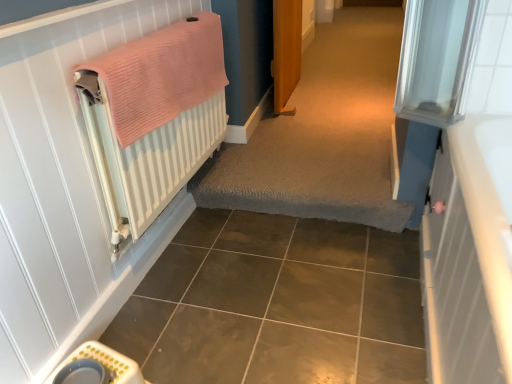
Describe the element at coordinates (162, 75) in the screenshot. The height and width of the screenshot is (384, 512). I see `pink knitted towel at left` at that location.

This screenshot has height=384, width=512. Describe the element at coordinates (146, 158) in the screenshot. I see `white textured radiator at left` at that location.

Describe the element at coordinates (323, 134) in the screenshot. This screenshot has width=512, height=384. I see `textured carpet at center` at that location.

Find the location of a particular element. pink knitted towel at left is located at coordinates (162, 75).

Who is taller, brown glossy ceramic tile at lower center or white textured radiator at left?

Standing taller between the two is white textured radiator at left.

From the image's perspective, who appears lower, brown glossy ceramic tile at lower center or white textured radiator at left?

brown glossy ceramic tile at lower center appears lower in the image.

Does brown glossy ceramic tile at lower center touch white textured radiator at left?

They are not placed beside each other.

Can you tell me how much pink knitted towel at left and white textured radiator at left differ in facing direction?

They differ by 0.00182 degrees in their facing directions.

In terms of size, does pink knitted towel at left appear bigger or smaller than white textured radiator at left?

pink knitted towel at left is smaller than white textured radiator at left.

Who is taller, pink knitted towel at left or white textured radiator at left?

Standing taller between the two is white textured radiator at left.

From the image's perspective, which one is positioned higher, pink knitted towel at left or white textured radiator at left?

pink knitted towel at left, from the image's perspective.

Considering the sizes of objects brown glossy ceramic tile at lower center and pink knitted towel at left in the image provided, who is thinner, brown glossy ceramic tile at lower center or pink knitted towel at left?

pink knitted towel at left.

This screenshot has height=384, width=512. What are the coordinates of `bath towel lying above the brown glossy ceramic tile at lower center (from the image's perspective)` in the screenshot? It's located at click(x=162, y=75).

Is brown glossy ceramic tile at lower center touching pink knitted towel at left?

No, brown glossy ceramic tile at lower center is not in contact with pink knitted towel at left.

Considering the positions of objects brown glossy ceramic tile at lower center and pink knitted towel at left in the image provided, who is in front, brown glossy ceramic tile at lower center or pink knitted towel at left?

Positioned in front is brown glossy ceramic tile at lower center.

Based on the photo, considering the relative positions of pink knitted towel at left and textured carpet at center in the image provided, is pink knitted towel at left to the right of textured carpet at center from the viewer's perspective?

No.

From a real-world perspective, is pink knitted towel at left positioned above or below textured carpet at center?

Clearly, from a real-world perspective, pink knitted towel at left is above textured carpet at center.

Consider the image. Is pink knitted towel at left touching textured carpet at center?

pink knitted towel at left and textured carpet at center are clearly separated.

Locate an element on the screen. bath towel above the textured carpet at center (from a real-world perspective) is located at coordinates (162, 75).

Does brown glossy ceramic tile at lower center come behind textured carpet at center?

That is False.

Is point (262, 231) farther from camera compared to point (345, 214)?

Yes, it is.

Is brown glossy ceramic tile at lower center not close to textured carpet at center?

Actually, brown glossy ceramic tile at lower center and textured carpet at center are a little close together.

The image size is (512, 384). Find the location of `plain to the right of brown glossy ceramic tile at lower center`. plain to the right of brown glossy ceramic tile at lower center is located at coordinates (323, 134).

Does white textured radiator at left have a lesser width compared to pink knitted towel at left?

Incorrect, the width of white textured radiator at left is not less than that of pink knitted towel at left.

How different are the orientations of white textured radiator at left and pink knitted towel at left in degrees?

The angular difference between white textured radiator at left and pink knitted towel at left is 0.00182 degrees.

In the image, is white textured radiator at left positioned in front of or behind pink knitted towel at left?

Clearly, white textured radiator at left is in front of pink knitted towel at left.

In the scene shown: From a real-world perspective, which is physically above, pink knitted towel at left or brown glossy ceramic tile at lower center?

pink knitted towel at left, from a real-world perspective.

Where is `bath towel behind the brown glossy ceramic tile at lower center`? This screenshot has width=512, height=384. bath towel behind the brown glossy ceramic tile at lower center is located at coordinates [162, 75].

Does point (126, 66) appear closer or farther from the camera than point (243, 366)?

Clearly, point (126, 66) is closer to the camera than point (243, 366).

The width and height of the screenshot is (512, 384). I want to click on radiator above the brown glossy ceramic tile at lower center (from a real-world perspective), so click(x=146, y=158).

Where is `bath towel behind the white textured radiator at left`? This screenshot has width=512, height=384. bath towel behind the white textured radiator at left is located at coordinates [x=162, y=75].

Which object lies nearer to the anchor point textured carpet at center, white textured radiator at left or brown glossy ceramic tile at lower center?

The object closer to textured carpet at center is brown glossy ceramic tile at lower center.

Considering their positions, is pink knitted towel at left positioned closer to white textured radiator at left than brown glossy ceramic tile at lower center?

pink knitted towel at left lies closer to white textured radiator at left than the other object.

Estimate the real-world distances between objects in this image. Which object is closer to pink knitted towel at left, white textured radiator at left or textured carpet at center?

white textured radiator at left lies closer to pink knitted towel at left than the other object.

Looking at the image, which one is located further to brown glossy ceramic tile at lower center, white textured radiator at left or pink knitted towel at left?

pink knitted towel at left.

Which object lies nearer to the anchor point textured carpet at center, pink knitted towel at left or brown glossy ceramic tile at lower center?

brown glossy ceramic tile at lower center lies closer to textured carpet at center than the other object.

Estimate the real-world distances between objects in this image. Which object is further from white textured radiator at left, textured carpet at center or pink knitted towel at left?

textured carpet at center is positioned further to the anchor white textured radiator at left.

Which object lies nearer to the anchor point white textured radiator at left, brown glossy ceramic tile at lower center or textured carpet at center?

brown glossy ceramic tile at lower center is positioned closer to the anchor white textured radiator at left.

Based on the photo, estimate the real-world distances between objects in this image. Which object is closer to textured carpet at center, brown glossy ceramic tile at lower center or pink knitted towel at left?

brown glossy ceramic tile at lower center lies closer to textured carpet at center than the other object.

The height and width of the screenshot is (384, 512). I want to click on bath towel between textured carpet at center and brown glossy ceramic tile at lower center vertically, so click(162, 75).

At what (x,y) coordinates should I click in order to perform the action: click on radiator between textured carpet at center and brown glossy ceramic tile at lower center in the up-down direction. Please return your answer as a coordinate pair (x, y). The height and width of the screenshot is (384, 512). Looking at the image, I should click on (146, 158).

At what (x,y) coordinates should I click in order to perform the action: click on radiator between pink knitted towel at left and brown glossy ceramic tile at lower center in the vertical direction. Please return your answer as a coordinate pair (x, y). Image resolution: width=512 pixels, height=384 pixels. Looking at the image, I should click on (146, 158).

Locate an element on the screen. bath towel between white textured radiator at left and textured carpet at center in the horizontal direction is located at coordinates (162, 75).